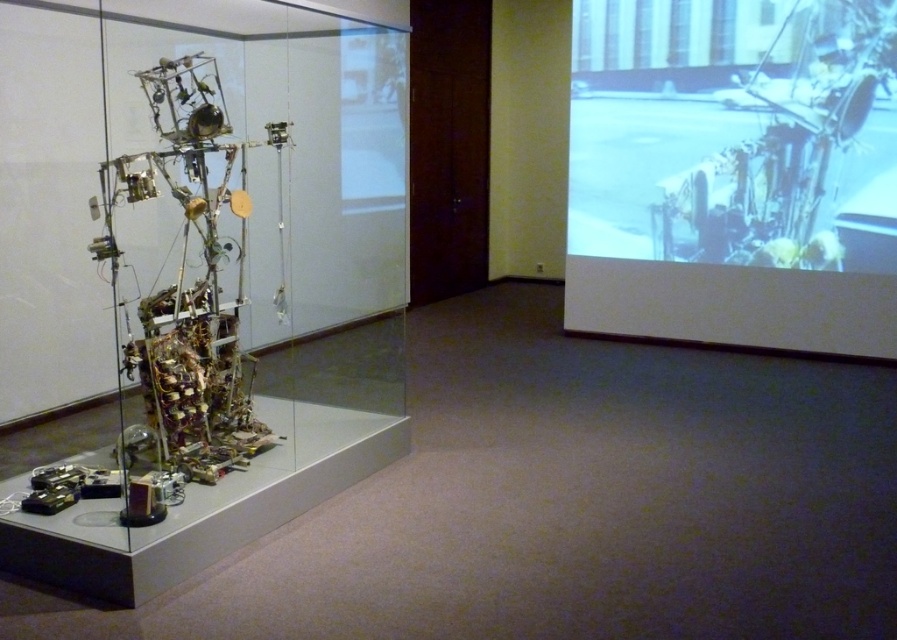
Based on the photo, does transparent glass sculpture at left lie behind white matte screen at upper right?

No.

Who is positioned more to the right, transparent glass sculpture at left or white matte screen at upper right?

Positioned to the right is white matte screen at upper right.

Between point (77, 36) and point (756, 26), which one is positioned behind?

The point (756, 26) is behind.

Where is `transparent glass sculpture at left`? The height and width of the screenshot is (640, 897). transparent glass sculpture at left is located at coordinates (193, 276).